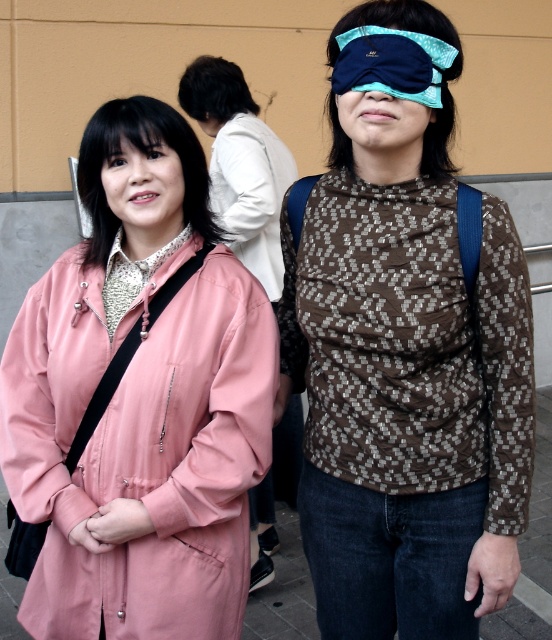
Between pink fabric coat at left and matte pink coat at left, which one has more height?

pink fabric coat at left is taller.

Can you confirm if pink fabric coat at left is bigger than matte pink coat at left?

Yes.

Is point (29, 394) behind point (136, 128)?

Yes, it is.

The image size is (552, 640). I want to click on pink fabric coat at left, so click(140, 401).

Between pink matte jacket at left and blue fabric blindfold at upper center, which one is positioned higher?

pink matte jacket at left is above.

Does pink matte jacket at left appear over blue fabric blindfold at upper center?

Yes.

What do you see at coordinates (241, 164) in the screenshot? I see `pink matte jacket at left` at bounding box center [241, 164].

The image size is (552, 640). In order to click on pink matte jacket at left in this screenshot , I will do `click(241, 164)`.

Is brown textured jacket at center smaller than dark brown hair at upper center?

No.

Can you confirm if brown textured jacket at center is positioned to the left of dark brown hair at upper center?

In fact, brown textured jacket at center is to the right of dark brown hair at upper center.

Is point (501, 515) more distant than point (209, 106)?

That is False.

I want to click on brown textured jacket at center, so click(x=411, y=342).